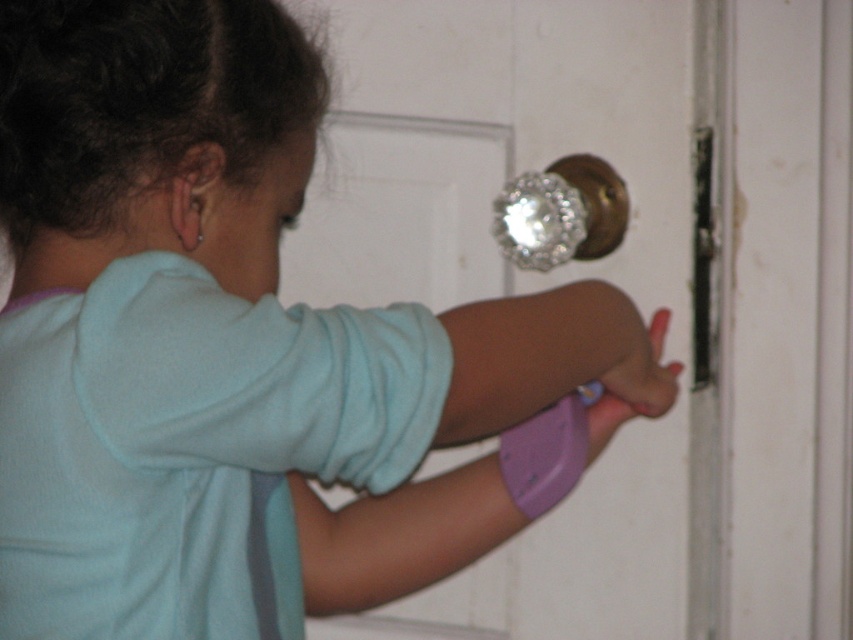
You are a delivery person standing at the camera position. You need to deliver a package to a point that is 4.51 feet away from your current position. Can you reach the point marked as point (415, 134) with your current position?

Yes, because the distance between point (415, 134) and the camera is exactly 4.51 feet, so you can reach it.

The child is trying to reach the dull metallic knob at upper right while holding the purple matte wristband at lower center. Which object is taller?

The purple matte wristband at lower center is taller than the dull metallic knob at upper right.

You are a robot with a height of 1.5 meters. You need to reach the dull metallic knob at upper right to open the door. Can you reach it?

The dull metallic knob at upper right is 1.26 meters from the camera. Since the robot is 1.5 meters tall, it can reach the knob as it is within its height range.